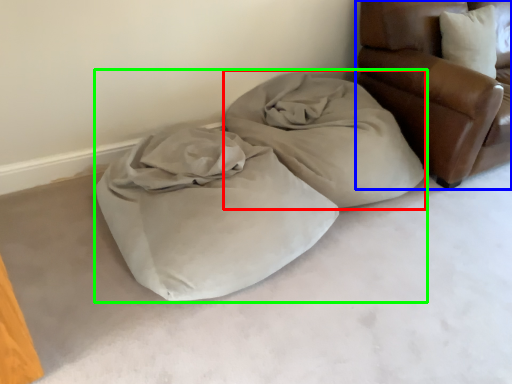
Question: Which is nearer to the cloth (highlighted by a red box)? furniture (highlighted by a blue box) or bed (highlighted by a green box).

Choices:
 (A) furniture
 (B) bed

Answer: (B)